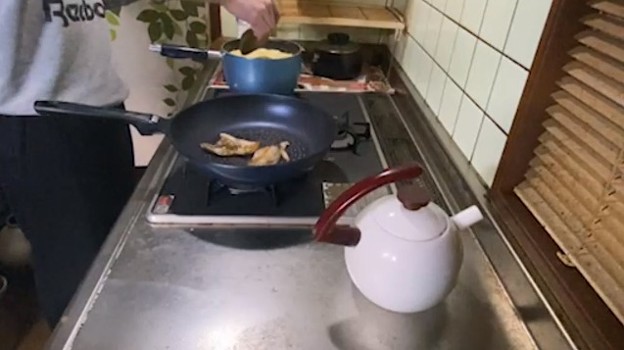
Locate an element on the screen. The height and width of the screenshot is (350, 624). blinds is located at coordinates (583, 190).